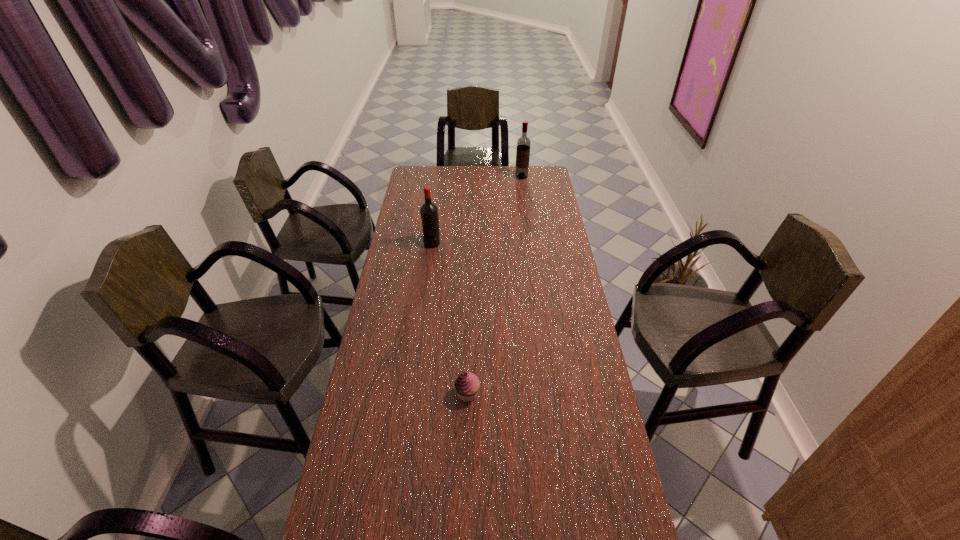
In order to click on object present at the left edge in this screenshot , I will do `click(429, 212)`.

Where is `object situated at the right edge`? The height and width of the screenshot is (540, 960). object situated at the right edge is located at coordinates (523, 143).

The width and height of the screenshot is (960, 540). Identify the location of object located at the far right corner. (523, 143).

In the image, there is a desktop. Where is `free space at the far edge`? The image size is (960, 540). free space at the far edge is located at coordinates (484, 185).

You are a GUI agent. You are given a task and a screenshot of the screen. Output one action in this format:
    pyautogui.click(x=<x>, y=<y>)
    Task: Click on the vacant area at the left edge
    This screenshot has height=540, width=960.
    Given the screenshot: What is the action you would take?
    pyautogui.click(x=422, y=282)

Identify the location of vacant region at the right edge of the desktop. This screenshot has width=960, height=540. (548, 253).

In order to click on free region at the far right corner of the desktop in this screenshot , I will do `click(525, 180)`.

Identify the location of vacant area that lies between the second object from right to left and the nearer wine bottle. click(450, 318).

This screenshot has width=960, height=540. In order to click on vacant area that lies between the nearest object and the rightmost object in this screenshot , I will do `click(494, 285)`.

At what (x,y) coordinates should I click in order to perform the action: click on free point between the leftmost object and the nearest object. Please return your answer as a coordinate pair (x, y). The height and width of the screenshot is (540, 960). Looking at the image, I should click on (450, 318).